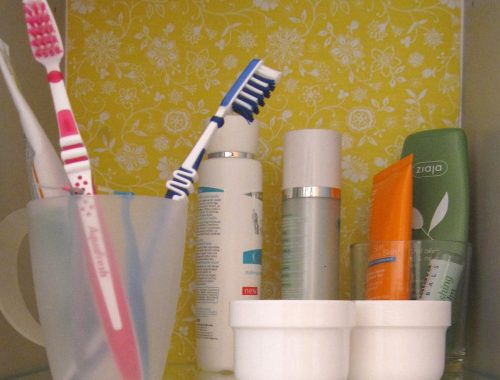
This screenshot has width=500, height=380. What are the coordinates of `1 red and white toothbrush` in the screenshot? It's located at (77, 157).